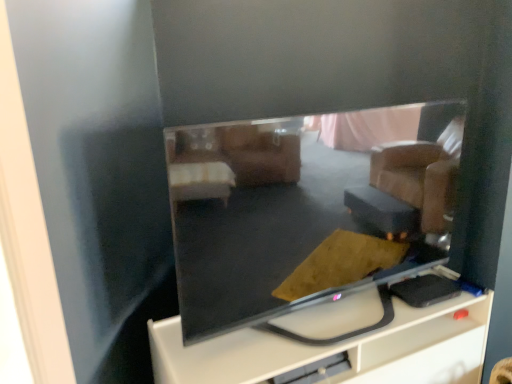
The height and width of the screenshot is (384, 512). In order to click on free point below matte black tv at center (from a real-world perspective) in this screenshot , I will do point(313,332).